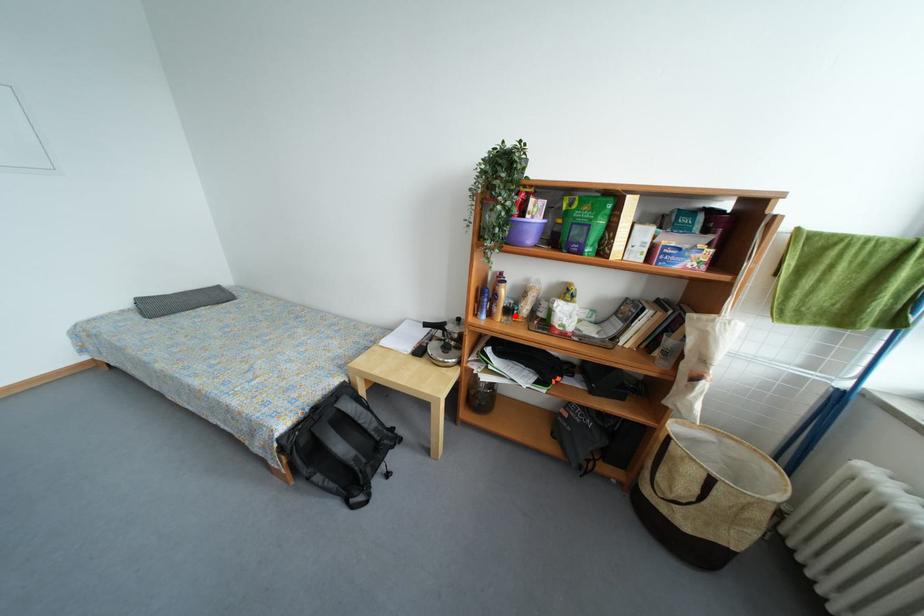
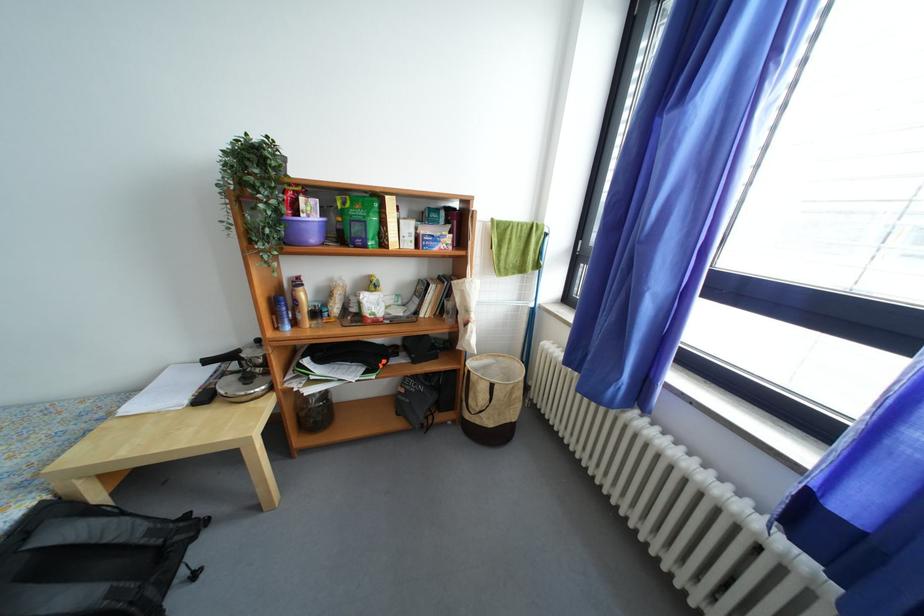
Find the pixel in the second image that matches the highlighted location in the first image.

(322, 318)